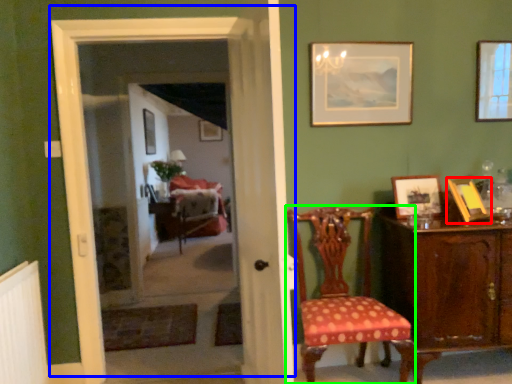
Question: Considering the real-world distances, which object is closest to picture frame (highlighted by a red box)? door (highlighted by a blue box) or chair (highlighted by a green box).

Choices:
 (A) door
 (B) chair

Answer: (B)